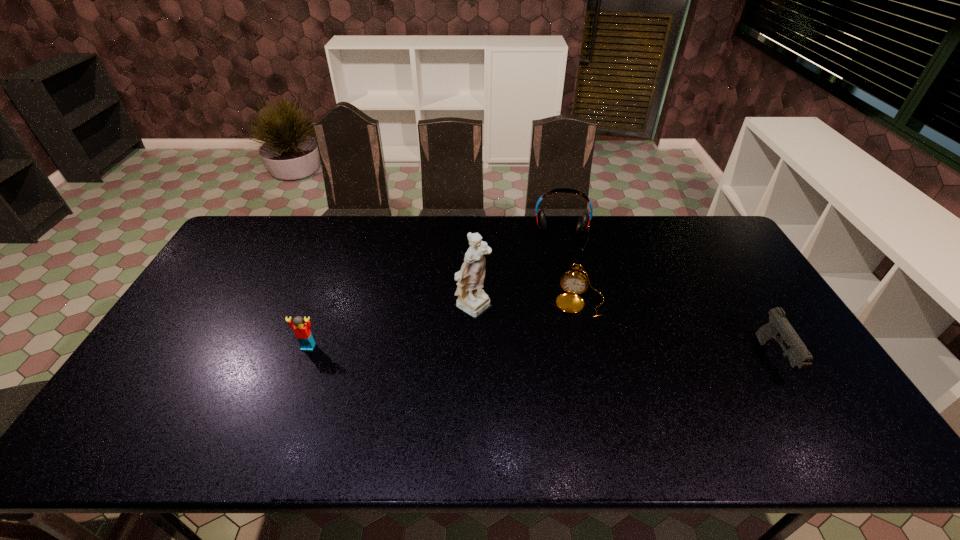
The width and height of the screenshot is (960, 540). I want to click on vacant space on the desktop that is between the Lego and the pistol and is positioned on the front-facing side of the tallest object, so click(x=565, y=354).

Identify the location of free space on the desktop that is between the Lego and the pistol and is positioned with the microphone attached to the side of the second tallest object. (561, 354).

Where is `free spot on the desktop that is between the Lego and the pistol and is positioned on the face of the pocket watch`? free spot on the desktop that is between the Lego and the pistol and is positioned on the face of the pocket watch is located at coordinates (570, 354).